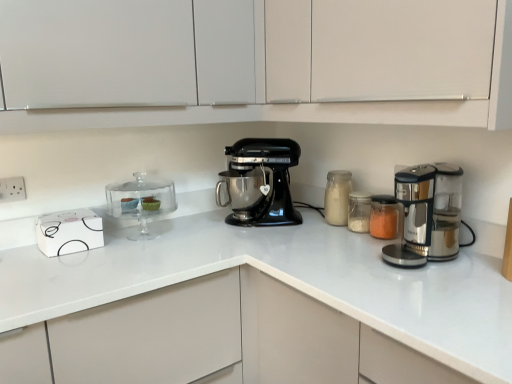
Question: Is white matte cabinet at upper center, which is the 1th cabinetry in right-to-left order, not within translucent glass jar at center, placed as the 1th appliance when sorted from right to left?

Choices:
 (A) no
 (B) yes

Answer: (B)

Question: Is white matte cabinet at upper center, the second cabinetry positioned from the left, facing away from translucent glass jar at center, which appears as the third appliance when viewed from the left?

Choices:
 (A) no
 (B) yes

Answer: (A)

Question: Is white matte cabinet at upper center, the second cabinetry positioned from the left, facing towards translucent glass jar at center, placed as the 1th appliance when sorted from right to left?

Choices:
 (A) no
 (B) yes

Answer: (A)

Question: Is white matte cabinet at upper center, the second cabinetry positioned from the left, to the left of translucent glass jar at center, placed as the 1th appliance when sorted from right to left, from the viewer's perspective?

Choices:
 (A) no
 (B) yes

Answer: (B)

Question: Is white matte cabinet at upper center, which is the 1th cabinetry in right-to-left order, positioned behind translucent glass jar at center, placed as the 1th appliance when sorted from right to left?

Choices:
 (A) no
 (B) yes

Answer: (A)

Question: Looking at their shapes, would you say clear glass cake stand at left, the 1th appliance from the left, is wider or thinner than white plastic electric outlet at upper left?

Choices:
 (A) thin
 (B) wide

Answer: (B)

Question: Considering the positions of point (150, 208) and point (12, 198), is point (150, 208) closer or farther from the camera than point (12, 198)?

Choices:
 (A) closer
 (B) farther

Answer: (B)

Question: From a real-world perspective, is clear glass cake stand at left, the 3th appliance in the right-to-left sequence, physically located above or below white plastic electric outlet at upper left?

Choices:
 (A) above
 (B) below

Answer: (B)

Question: Is clear glass cake stand at left, the 1th appliance from the left, bigger or smaller than white plastic electric outlet at upper left?

Choices:
 (A) small
 (B) big

Answer: (B)

Question: Which is correct: translucent glass jar at center, acting as the second appliance starting from the left, is inside translucent glass jar at center, which appears as the third appliance when viewed from the left, or outside of it?

Choices:
 (A) outside
 (B) inside

Answer: (A)

Question: Considering the positions of translucent glass jar at center, acting as the second appliance starting from the left, and translucent glass jar at center, which appears as the third appliance when viewed from the left, in the image, is translucent glass jar at center, acting as the second appliance starting from the left, bigger or smaller than translucent glass jar at center, which appears as the third appliance when viewed from the left,?

Choices:
 (A) big
 (B) small

Answer: (B)

Question: Is translucent glass jar at center, placed as the second appliance when sorted from right to left, to the left or to the right of translucent glass jar at center, which appears as the third appliance when viewed from the left, in the image?

Choices:
 (A) left
 (B) right

Answer: (A)

Question: In the image, is translucent glass jar at center, acting as the second appliance starting from the left, positioned in front of or behind translucent glass jar at center, which appears as the third appliance when viewed from the left?

Choices:
 (A) front
 (B) behind

Answer: (B)

Question: From a real-world perspective, is translucent glass jar at center-right positioned above or below translucent glass jar at center, placed as the 1th appliance when sorted from right to left?

Choices:
 (A) above
 (B) below

Answer: (A)

Question: Based on their positions, is translucent glass jar at center-right located to the left or right of translucent glass jar at center, which appears as the third appliance when viewed from the left?

Choices:
 (A) left
 (B) right

Answer: (A)